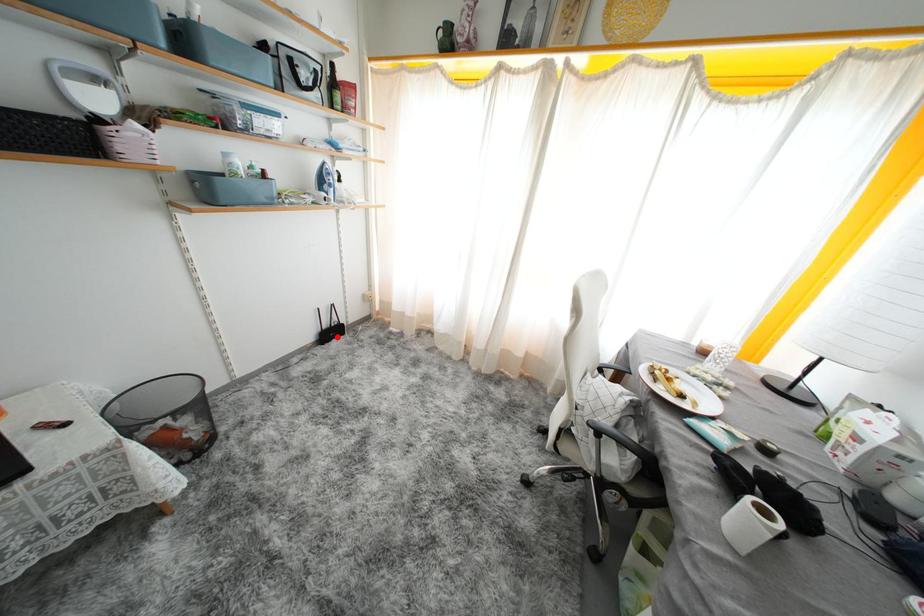
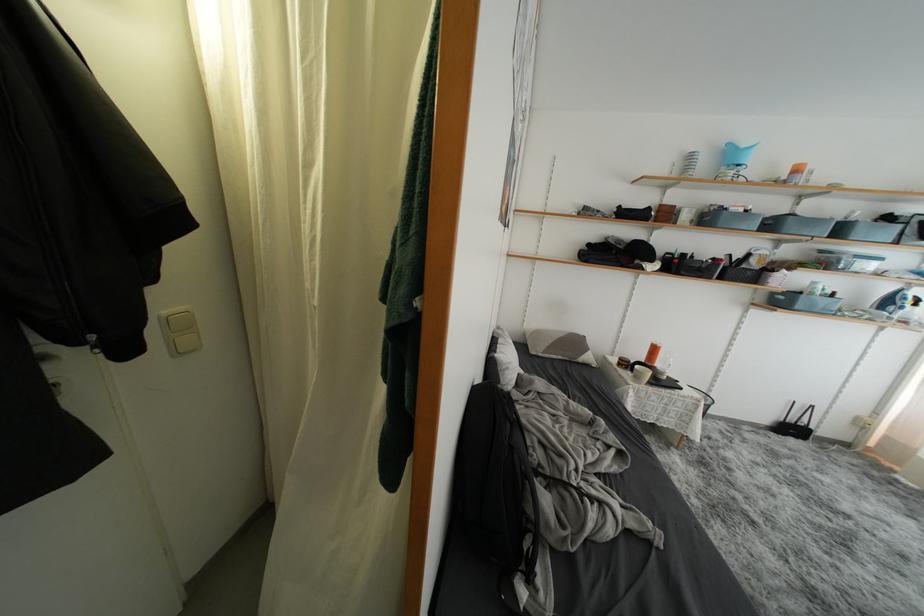
Question: I am providing you with two images of the same scene from different viewpoints. Image1 has a red point marked. In image2, the corresponding 3D location appears at what relative position? Reply with the corresponding letter.

Choices:
 (A) Closer
 (B) Farther

Answer: (B)